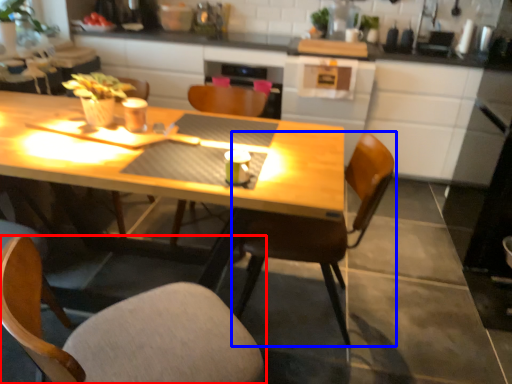
Question: Which of the following is the closest to the observer, chair (highlighted by a red box) or chair (highlighted by a blue box)?

Choices:
 (A) chair
 (B) chair

Answer: (A)